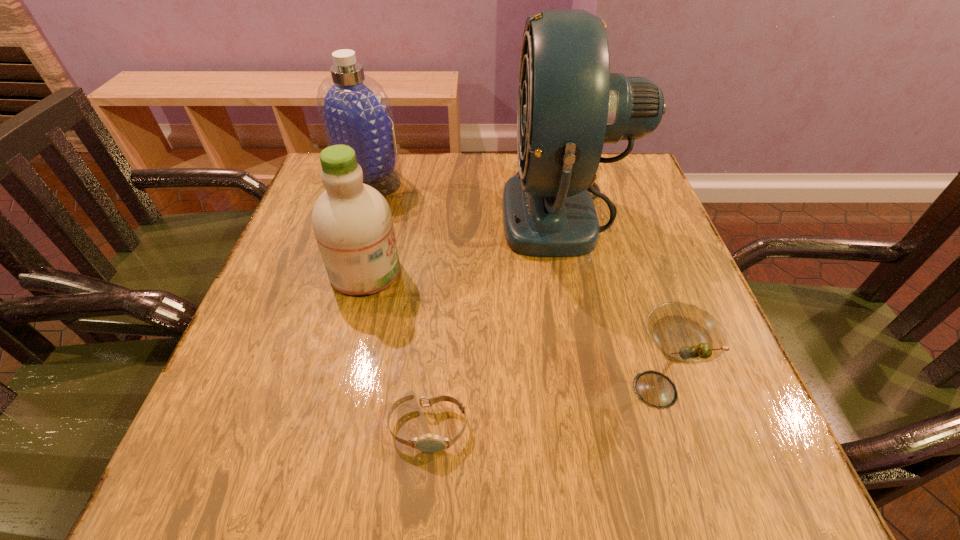
The image size is (960, 540). What are the coordinates of `vacant region located 0.210m on the front label of the nearer cleansing agent` in the screenshot? It's located at (501, 272).

Image resolution: width=960 pixels, height=540 pixels. Identify the location of free point located on the left of the martini. (532, 389).

Identify the location of fan that is at the far edge. This screenshot has width=960, height=540. (569, 105).

I want to click on cleansing agent that is positioned at the far edge, so click(x=354, y=109).

Locate an element on the screen. The width and height of the screenshot is (960, 540). object that is at the near edge is located at coordinates (431, 443).

Image resolution: width=960 pixels, height=540 pixels. Find the location of `fan present at the right edge`. fan present at the right edge is located at coordinates (569, 105).

Where is `martini present at the right edge`? Image resolution: width=960 pixels, height=540 pixels. martini present at the right edge is located at coordinates (683, 333).

You are a GUI agent. You are given a task and a screenshot of the screen. Output one action in this format:
    pyautogui.click(x=<x>, y=<y>)
    Task: Click on the object situated at the far left corner
    The width and height of the screenshot is (960, 540).
    Given the screenshot: What is the action you would take?
    pyautogui.click(x=354, y=109)

Image resolution: width=960 pixels, height=540 pixels. I want to click on object that is at the far right corner, so (569, 105).

Where is `free region at the far edge of the desktop`? The width and height of the screenshot is (960, 540). free region at the far edge of the desktop is located at coordinates (472, 199).